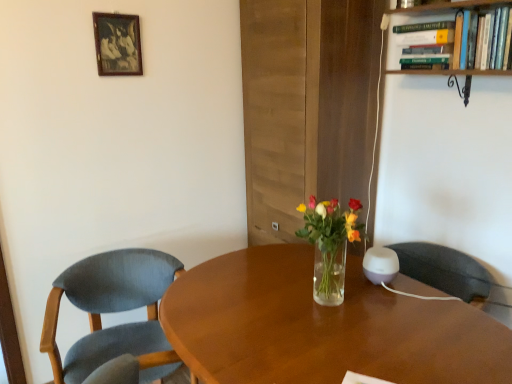
Question: Considering the relative sizes of wooden picture frame at upper left and textured blue fabric chair at left in the image provided, is wooden picture frame at upper left taller than textured blue fabric chair at left?

Choices:
 (A) no
 (B) yes

Answer: (A)

Question: Is wooden picture frame at upper left next to textured blue fabric chair at left and touching it?

Choices:
 (A) yes
 (B) no

Answer: (B)

Question: Is wooden picture frame at upper left to the left of textured blue fabric chair at left from the viewer's perspective?

Choices:
 (A) no
 (B) yes

Answer: (B)

Question: Would you say wooden picture frame at upper left is outside textured blue fabric chair at left?

Choices:
 (A) yes
 (B) no

Answer: (A)

Question: Is wooden picture frame at upper left facing away from textured blue fabric chair at left?

Choices:
 (A) yes
 (B) no

Answer: (B)

Question: Does wooden picture frame at upper left have a lesser height compared to textured blue fabric chair at left?

Choices:
 (A) yes
 (B) no

Answer: (A)

Question: Does textured blue fabric chair at left have a smaller size compared to wooden desk at center?

Choices:
 (A) yes
 (B) no

Answer: (B)

Question: Can wooden desk at center be found inside textured blue fabric chair at left?

Choices:
 (A) no
 (B) yes

Answer: (A)

Question: From a real-world perspective, is textured blue fabric chair at left on wooden desk at center?

Choices:
 (A) yes
 (B) no

Answer: (B)

Question: Is textured blue fabric chair at left closer to camera compared to wooden desk at center?

Choices:
 (A) no
 (B) yes

Answer: (B)

Question: Considering the relative positions of textured blue fabric chair at left and wooden desk at center in the image provided, is textured blue fabric chair at left behind wooden desk at center?

Choices:
 (A) yes
 (B) no

Answer: (B)

Question: Are textured blue fabric chair at left and wooden desk at center making contact?

Choices:
 (A) no
 (B) yes

Answer: (A)

Question: Is green hardcover book at upper right behind wooden bookshelf at upper right?

Choices:
 (A) no
 (B) yes

Answer: (B)